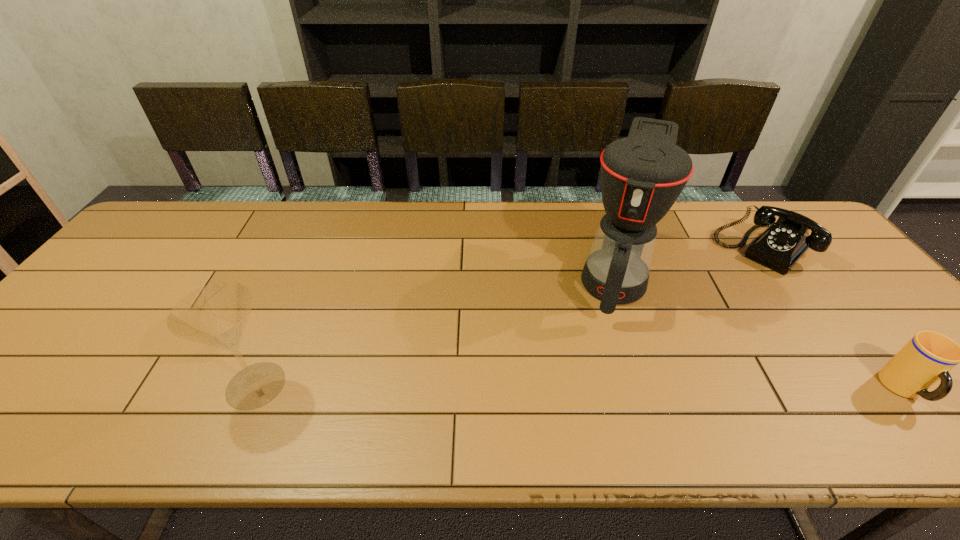
Find the location of a particular element. free space on the desktop that is between the third shortest object and the cup and is positioned pour from the carafe of the tallest object is located at coordinates (588, 388).

Find the location of a particular element. Image resolution: width=960 pixels, height=540 pixels. vacant space on the desktop that is between the leftmost object and the cup and is positioned on the dial of the telephone is located at coordinates (625, 388).